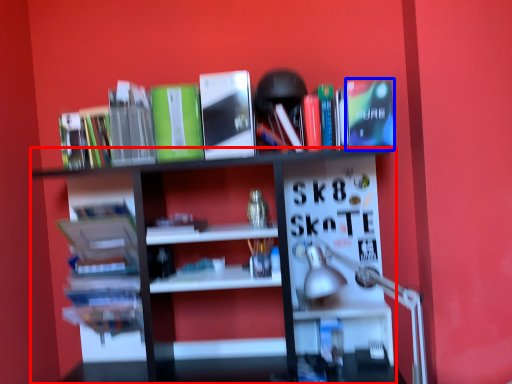
Question: Among these objects, which one is nearest to the camera, shelf (highlighted by a red box) or paperback book (highlighted by a blue box)?

Choices:
 (A) shelf
 (B) paperback book

Answer: (A)